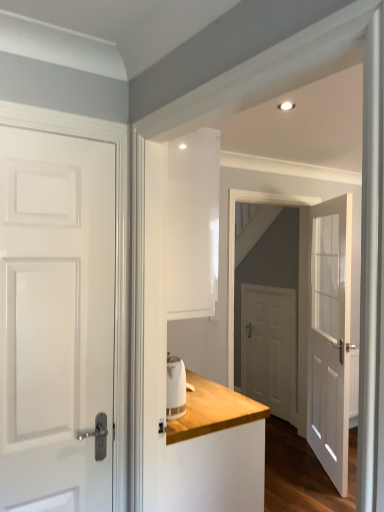
This screenshot has height=512, width=384. What are the coordinates of `white matte door at center, arranged as the second door when viewed from the right` in the screenshot? It's located at (269, 348).

In order to face white glass door at center, the 2th door from the back, should I rotate leftwards or rightwards?

Turn right by 17.478 degrees to look at white glass door at center, the 2th door from the back.

Locate an element on the screen. white glossy door at center is located at coordinates (325, 333).

This screenshot has height=512, width=384. Describe the element at coordinates (55, 318) in the screenshot. I see `white glossy door at left, the third door from the back` at that location.

The width and height of the screenshot is (384, 512). Find the location of `white glossy kettle at center`. white glossy kettle at center is located at coordinates 176,387.

Between white glossy door at center and white wood dresser at center, which one has larger width?

With larger width is white wood dresser at center.

From a real-world perspective, does white glossy door at center sit lower than white wood dresser at center?

No, from a real-world perspective, white glossy door at center is not under white wood dresser at center.

Considering their positions, is white glossy door at center located in front of or behind white wood dresser at center?

Visually, white glossy door at center is located behind white wood dresser at center.

Which door is the 1st one when counting from the right side of the white glossy kettle at center? Please provide its 2D coordinates.

[(269, 348)]

Based on their sizes in the image, would you say white matte door at center, which appears as the second door when viewed from the left, is bigger or smaller than white glossy kettle at center?

In the image, white matte door at center, which appears as the second door when viewed from the left, appears to be larger than white glossy kettle at center.

From the image's perspective, is white matte door at center, acting as the 1th door starting from the back, located above white glossy kettle at center?

Incorrect, from the image's perspective, white matte door at center, acting as the 1th door starting from the back, is lower than white glossy kettle at center.

Is point (266, 362) behind point (170, 374)?

Yes, it is behind point (170, 374).

From the image's perspective, which is above, white glossy door at left, the third door from the back, or white glossy door at center?

white glossy door at left, the third door from the back, is shown above in the image.

Does white glossy door at left, positioned as the first door in front-to-back order, have a greater width compared to white glossy door at center?

Incorrect, the width of white glossy door at left, positioned as the first door in front-to-back order, does not surpass that of white glossy door at center.

Is white glossy door at left, the third door from the back, outside of white glossy door at center?

white glossy door at left, the third door from the back, lies outside white glossy door at center's area.

Image resolution: width=384 pixels, height=512 pixels. I want to click on door that is the 1st object to the right of the white glossy door at left, placed as the 3th door when sorted from right to left, starting at the anchor, so click(x=269, y=348).

How different are the orientations of white glossy door at left, positioned as the first door in front-to-back order, and white matte door at center, which appears as the second door when viewed from the left, in degrees?

white glossy door at left, positioned as the first door in front-to-back order, and white matte door at center, which appears as the second door when viewed from the left, are facing 89.6 degrees away from each other.

Between white glossy door at left, placed as the 3th door when sorted from right to left, and white matte door at center, acting as the 1th door starting from the back, which one appears on the right side from the viewer's perspective?

Positioned to the right is white matte door at center, acting as the 1th door starting from the back.

From a real-world perspective, is white glossy door at left, placed as the 3th door when sorted from right to left, over white matte door at center, arranged as the second door when viewed from the right?

Yes, from a real-world perspective, white glossy door at left, placed as the 3th door when sorted from right to left, is over white matte door at center, arranged as the second door when viewed from the right

Is white glossy door at center to the left of white glossy kettle at center from the viewer's perspective?

In fact, white glossy door at center is to the right of white glossy kettle at center.

Considering the relative sizes of white glossy door at center and white glossy kettle at center in the image provided, is white glossy door at center bigger than white glossy kettle at center?

Indeed, white glossy door at center has a larger size compared to white glossy kettle at center.

Which is behind, point (342, 464) or point (183, 364)?

Point (342, 464)

How many degrees apart are the facing directions of white glossy door at center and white glossy kettle at center?

91.1 degrees separate the facing orientations of white glossy door at center and white glossy kettle at center.

Is white glossy kettle at center oriented away from white wood dresser at center?

No, white glossy kettle at center is not facing away from white wood dresser at center.

Which is in front, white glossy kettle at center or white wood dresser at center?

white wood dresser at center is more forward.

Is white glossy kettle at center not near white wood dresser at center?

No, white glossy kettle at center is not far away from white wood dresser at center.

How many degrees apart are the facing directions of white glossy door at center and white glossy door at left, the third door from the back?

The angle between the facing direction of white glossy door at center and the facing direction of white glossy door at left, the third door from the back, is 2.35 degrees.

Does white glossy door at center have a larger size compared to white glossy door at left, the third door from the back?

Indeed, white glossy door at center has a larger size compared to white glossy door at left, the third door from the back.

Is white glossy door at center aimed at white glossy door at left, placed as the 3th door when sorted from right to left?

No, white glossy door at center is not turned towards white glossy door at left, placed as the 3th door when sorted from right to left.

How distant is white glossy door at center from white glossy door at left, placed as the 1th door when sorted from left to right?

The distance of white glossy door at center from white glossy door at left, placed as the 1th door when sorted from left to right, is 5.75 feet.

In order to click on dresser below the white glossy door at center (from the image's perspective) in this screenshot , I will do `click(215, 451)`.

Identify the location of sink above the white matte door at center, which appears as the second door when viewed from the left (from the image's perspective). The image size is (384, 512). (x=176, y=387).

Looking at the image, which one is located closer to white wood dresser at center, white matte door at center, which appears as the second door when viewed from the left, or white glossy door at center?

Based on the image, white glossy door at center appears to be nearer to white wood dresser at center.

Looking at the image, which one is located further to white wood dresser at center, white matte door at center, which appears as the 3th door when viewed from the front, or white glossy kettle at center?

white matte door at center, which appears as the 3th door when viewed from the front, is positioned further to the anchor white wood dresser at center.

In the scene shown: When comparing their distances from white glossy door at left, the third door from the back, does white glass door at center, the first door when ordered from right to left, or white wood dresser at center seem further?

Among the two, white glass door at center, the first door when ordered from right to left, is located further to white glossy door at left, the third door from the back.

From the image, which object appears to be nearer to white glossy kettle at center, white matte door at center, which appears as the 3th door when viewed from the front, or white glass door at center, the 2th door from the back?

white glass door at center, the 2th door from the back, lies closer to white glossy kettle at center than the other object.

Which object lies further to the anchor point white glossy kettle at center, white glossy door at left, the third door from the back, or white glossy door at center?

white glossy door at center is further to white glossy kettle at center.

Considering their positions, is white glass door at center, the 2th door from the back, positioned closer to white glossy kettle at center than white wood dresser at center?

white wood dresser at center is positioned closer to the anchor white glossy kettle at center.

From the image, which object appears to be nearer to white wood dresser at center, white glossy door at left, the third door from the back, or white matte door at center, acting as the 1th door starting from the back?

Among the two, white glossy door at left, the third door from the back, is located nearer to white wood dresser at center.

Based on their spatial positions, is white glass door at center, the 2th door from the back, or white matte door at center, which appears as the 3th door when viewed from the front, closer to white glossy door at center?

white glass door at center, the 2th door from the back.

This screenshot has height=512, width=384. Find the location of `screen door between white wood dresser at center and white matte door at center, arranged as the second door when viewed from the right, from front to back`. screen door between white wood dresser at center and white matte door at center, arranged as the second door when viewed from the right, from front to back is located at coordinates pos(325,333).

You are a GUI agent. You are given a task and a screenshot of the screen. Output one action in this format:
    pyautogui.click(x=<x>, y=<y>)
    Task: Click on the door between white glossy kettle at center and white glossy door at center in the front-back direction
    Image resolution: width=384 pixels, height=512 pixels.
    Given the screenshot: What is the action you would take?
    pyautogui.click(x=330, y=336)

In order to click on screen door between white glass door at center, placed as the 3th door when sorted from left to right, and white matte door at center, acting as the 1th door starting from the back, in the front-back direction in this screenshot , I will do `click(325, 333)`.

Where is `dresser between white glossy door at left, the third door from the back, and white glossy door at center in the front-back direction`? dresser between white glossy door at left, the third door from the back, and white glossy door at center in the front-back direction is located at coordinates (215, 451).